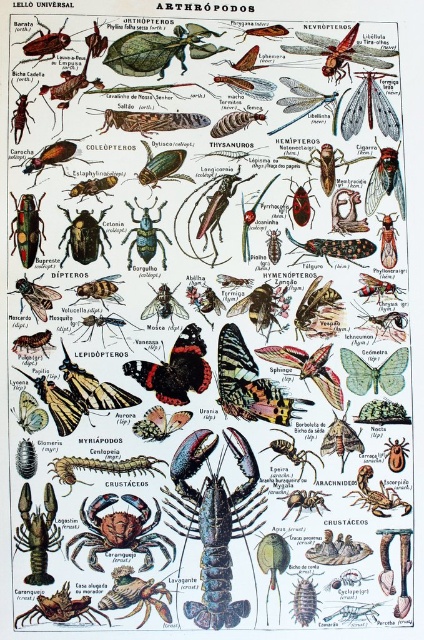
Does shiny metallic beetle at center have a lesser width compared to translucent yellowish-green ant at center?

Yes, shiny metallic beetle at center is thinner than translucent yellowish-green ant at center.

Does shiny metallic beetle at center appear on the left side of translucent yellowish-green ant at center?

Correct, you'll find shiny metallic beetle at center to the left of translucent yellowish-green ant at center.

The height and width of the screenshot is (640, 424). I want to click on shiny metallic beetle at center, so click(x=27, y=228).

The height and width of the screenshot is (640, 424). Identify the location of shiny metallic beetle at center. (27, 228).

Which is below, shiny metallic beetle at center-left or shiny metallic beetle at center?

Positioned lower is shiny metallic beetle at center-left.

From the picture: Can you confirm if shiny metallic beetle at center-left is smaller than shiny metallic beetle at center?

Actually, shiny metallic beetle at center-left might be larger than shiny metallic beetle at center.

Does point (78, 252) come closer to viewer compared to point (19, 225)?

No.

The width and height of the screenshot is (424, 640). What are the coordinates of `shiny metallic beetle at center-left` in the screenshot? It's located at (83, 237).

Looking at this image, is shiny blue lobster at lower left smaller than shiny metallic beetle at center-left?

Incorrect, shiny blue lobster at lower left is not smaller in size than shiny metallic beetle at center-left.

This screenshot has height=640, width=424. Describe the element at coordinates (38, 532) in the screenshot. I see `shiny blue lobster at lower left` at that location.

Identify the location of shiny blue lobster at lower left. This screenshot has height=640, width=424. (38, 532).

Locate an element on the screen. shiny blue lobster at lower left is located at coordinates (38, 532).